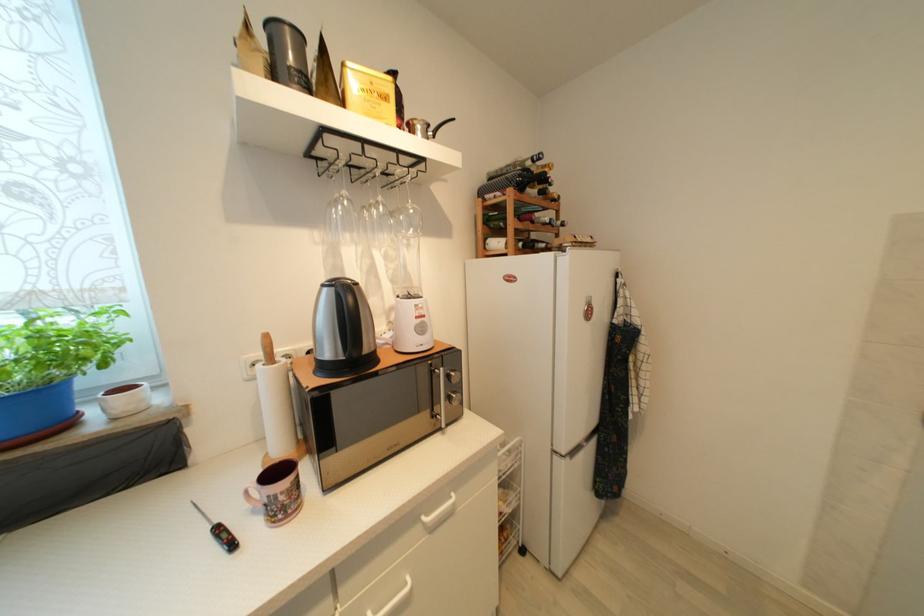
Describe the element at coordinates (411, 326) in the screenshot. I see `the blender pitcher` at that location.